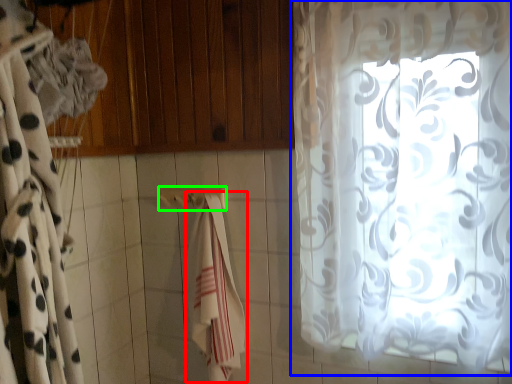
Question: Which object is positioned farthest from beach towel (highlighted by a red box)? Select from curtain (highlighted by a blue box) and towel bar (highlighted by a green box).

Choices:
 (A) curtain
 (B) towel bar

Answer: (A)